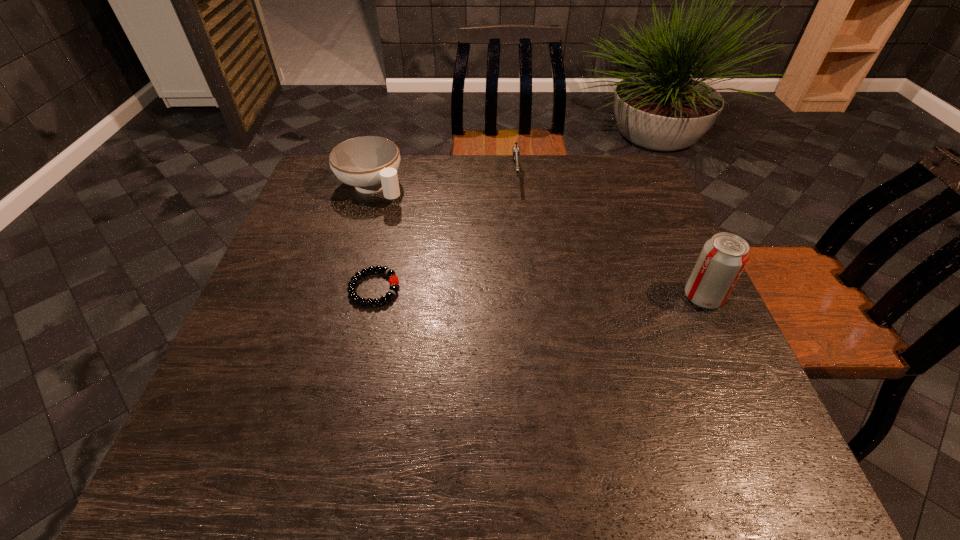
Where is `the shortest object`? the shortest object is located at coordinates (351, 289).

Image resolution: width=960 pixels, height=540 pixels. I want to click on the rightmost object, so click(x=723, y=257).

The width and height of the screenshot is (960, 540). Find the location of `the tallest object`. the tallest object is located at coordinates (723, 257).

Find the location of a particular element. chinaware is located at coordinates (369, 163).

This screenshot has height=540, width=960. Find the location of `pistol`. pistol is located at coordinates (516, 150).

You are a GUI agent. You are given a task and a screenshot of the screen. Output one action in this format:
    pyautogui.click(x=<x>, y=<y>)
    Task: Click on the second object from right to left
    The width and height of the screenshot is (960, 540).
    Given the screenshot: What is the action you would take?
    pyautogui.click(x=516, y=150)

Identify the location of vacant space located 0.150m on the front of the bracelet. Image resolution: width=960 pixels, height=540 pixels. (356, 367).

Where is `vacant position located 0.190m on the back of the tallest object`? The height and width of the screenshot is (540, 960). vacant position located 0.190m on the back of the tallest object is located at coordinates [672, 231].

Locate an element on the screen. vacant space located 0.290m on the side with the handle of the chinaware is located at coordinates (450, 258).

This screenshot has width=960, height=540. I want to click on free region located 0.140m on the side with the handle of the chinaware, so click(x=417, y=228).